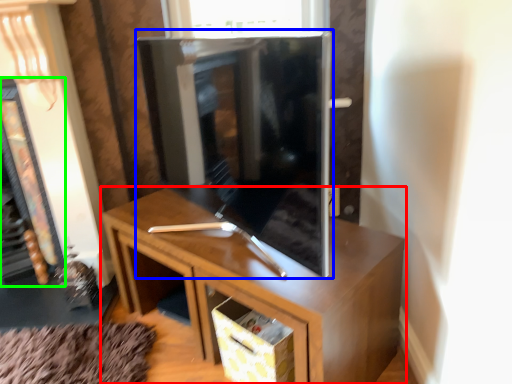
Question: Considering the real-world distances, which object is closest to cabinetry (highlighted by a red box)? tv cabinet (highlighted by a blue box) or fireplace (highlighted by a green box).

Choices:
 (A) tv cabinet
 (B) fireplace

Answer: (A)